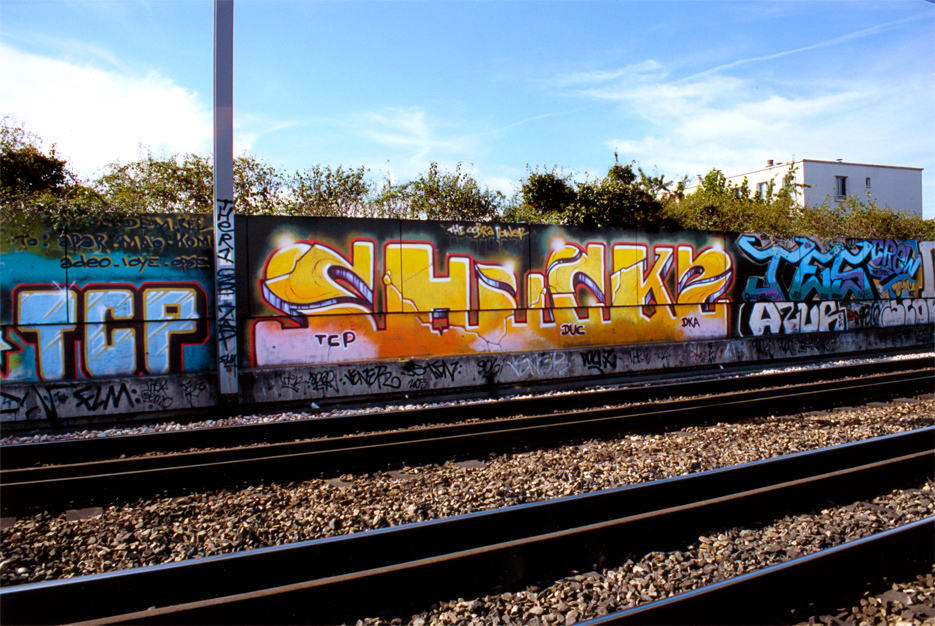
I want to click on wall, so click(x=294, y=371).